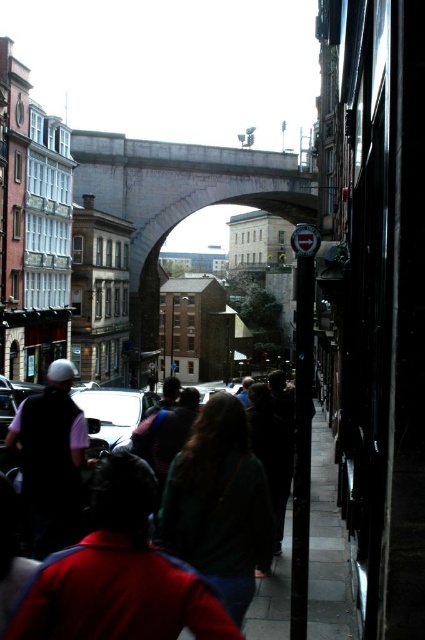
What do you see at coordinates (218, 504) in the screenshot? I see `dark green sweater at center` at bounding box center [218, 504].

Is dark green sweater at center bigger than shiny silver car at center?

Correct, dark green sweater at center is larger in size than shiny silver car at center.

At what (x,y) coordinates should I click in order to perform the action: click on dark green sweater at center. Please return your answer as a coordinate pair (x, y). Looking at the image, I should click on (218, 504).

What do you see at coordinates (218, 504) in the screenshot? I see `dark green sweater at center` at bounding box center [218, 504].

Identify the location of dark green sweater at center. The width and height of the screenshot is (425, 640). (218, 504).

You are a GUI agent. You are given a task and a screenshot of the screen. Output one action in this format:
    pyautogui.click(x=<x>, y=<y>)
    Task: Click on the dark green sweater at center
    
    Given the screenshot: What is the action you would take?
    click(x=218, y=504)

Between stone archway at center and dark green sweater at center, which one appears on the left side from the viewer's perspective?

stone archway at center is more to the left.

Locate an element on the screen. The width and height of the screenshot is (425, 640). stone archway at center is located at coordinates (178, 202).